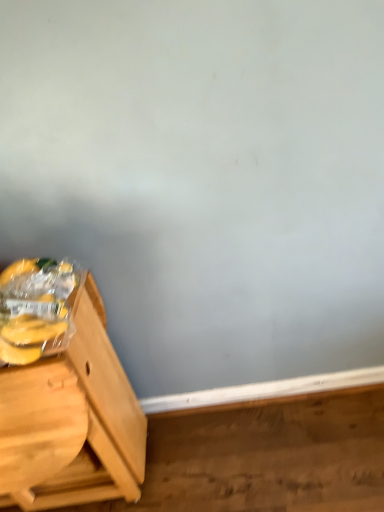
Where is `light brown wood table at left`? light brown wood table at left is located at coordinates tap(72, 422).

What is the approximate height of light brown wood table at left?

It is 29.97 inches.

Describe the element at coordinates (72, 422) in the screenshot. The height and width of the screenshot is (512, 384). I see `light brown wood table at left` at that location.

Image resolution: width=384 pixels, height=512 pixels. Describe the element at coordinates (34, 308) in the screenshot. I see `yellow matte plastic bananas at left` at that location.

I want to click on yellow matte plastic bananas at left, so click(x=34, y=308).

Measure the distance between point (58, 316) and camera.

A distance of 3.40 feet exists between point (58, 316) and camera.

Locate an element on the screen. Image resolution: width=384 pixels, height=512 pixels. light brown wood table at left is located at coordinates (72, 422).

Would you say yellow matte plastic bananas at left is to the left or to the right of light brown wood table at left in the picture?

yellow matte plastic bananas at left is to the right of light brown wood table at left.

Is yellow matte plastic bananas at left behind light brown wood table at left?

That is False.

Which is in front, point (38, 282) or point (113, 417)?

The point (38, 282) is closer to the camera.

From the image's perspective, is yellow matte plastic bananas at left on light brown wood table at left?

Yes.

From a real-world perspective, is yellow matte plastic bananas at left physically above light brown wood table at left?

Correct, in the physical world, yellow matte plastic bananas at left is higher than light brown wood table at left.

Does yellow matte plastic bananas at left have a greater width compared to light brown wood table at left?

Incorrect, the width of yellow matte plastic bananas at left does not surpass that of light brown wood table at left.

From the picture: Considering the relative sizes of yellow matte plastic bananas at left and light brown wood table at left in the image provided, is yellow matte plastic bananas at left shorter than light brown wood table at left?

Indeed, yellow matte plastic bananas at left has a lesser height compared to light brown wood table at left.

Which of these two, yellow matte plastic bananas at left or light brown wood table at left, is smaller?

With smaller size is yellow matte plastic bananas at left.

Is yellow matte plastic bananas at left spatially inside light brown wood table at left, or outside of it?

yellow matte plastic bananas at left exists outside the volume of light brown wood table at left.

Are yellow matte plastic bananas at left and light brown wood table at left far apart?

No, yellow matte plastic bananas at left is not far from light brown wood table at left.

Could you tell me if yellow matte plastic bananas at left is facing light brown wood table at left?

No.

Can you tell me how much yellow matte plastic bananas at left and light brown wood table at left differ in facing direction?

yellow matte plastic bananas at left and light brown wood table at left are facing 1.34 degrees away from each other.

Where is `banana above the light brown wood table at left (from a real-world perspective)`? Image resolution: width=384 pixels, height=512 pixels. banana above the light brown wood table at left (from a real-world perspective) is located at coordinates (34, 308).

Is light brown wood table at left at the right side of yellow matte plastic bananas at left?

No.

Does light brown wood table at left come behind yellow matte plastic bananas at left?

Yes, light brown wood table at left is further from the viewer.

Considering the positions of points (20, 380) and (0, 295), is point (20, 380) closer to camera compared to point (0, 295)?

Yes.

From the image's perspective, between light brown wood table at left and yellow matte plastic bananas at left, who is located below?

light brown wood table at left, from the image's perspective.

From a real-world perspective, is light brown wood table at left located higher than yellow matte plastic bananas at left?

Actually, light brown wood table at left is physically below yellow matte plastic bananas at left in the real world.

In terms of width, does light brown wood table at left look wider or thinner when compared to yellow matte plastic bananas at left?

In the image, light brown wood table at left appears to be wider than yellow matte plastic bananas at left.

Who is shorter, light brown wood table at left or yellow matte plastic bananas at left?

yellow matte plastic bananas at left is shorter.

Does light brown wood table at left have a smaller size compared to yellow matte plastic bananas at left?

Incorrect, light brown wood table at left is not smaller in size than yellow matte plastic bananas at left.

Is light brown wood table at left completely or partially outside of yellow matte plastic bananas at left?

That's correct, light brown wood table at left is outside of yellow matte plastic bananas at left.

Does light brown wood table at left touch yellow matte plastic bananas at left?

No, light brown wood table at left is not in contact with yellow matte plastic bananas at left.

In the scene shown: Is light brown wood table at left aimed at yellow matte plastic bananas at left?

No, light brown wood table at left is not oriented towards yellow matte plastic bananas at left.

Can you tell me how much light brown wood table at left and yellow matte plastic bananas at left differ in facing direction?

1.34 degrees separate the facing orientations of light brown wood table at left and yellow matte plastic bananas at left.

Identify the location of banana located on the right of light brown wood table at left. The image size is (384, 512). (34, 308).

At what (x,y) coordinates should I click in order to perform the action: click on banana lying in front of the light brown wood table at left. Please return your answer as a coordinate pair (x, y). Looking at the image, I should click on (34, 308).

The height and width of the screenshot is (512, 384). Find the location of `furniture behind the yellow matte plastic bananas at left`. furniture behind the yellow matte plastic bananas at left is located at coordinates (72, 422).